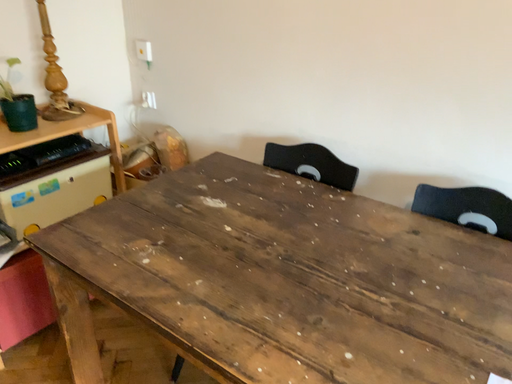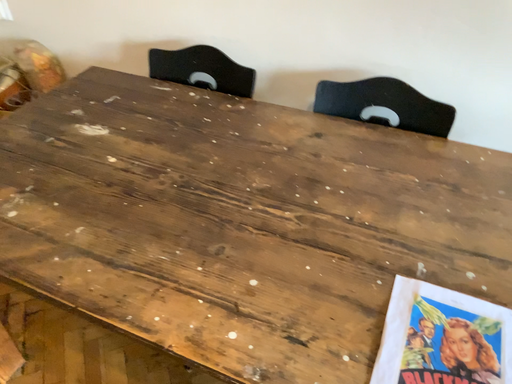
Question: How did the camera likely rotate when shooting the video?

Choices:
 (A) rotated downward
 (B) rotated upward

Answer: (A)